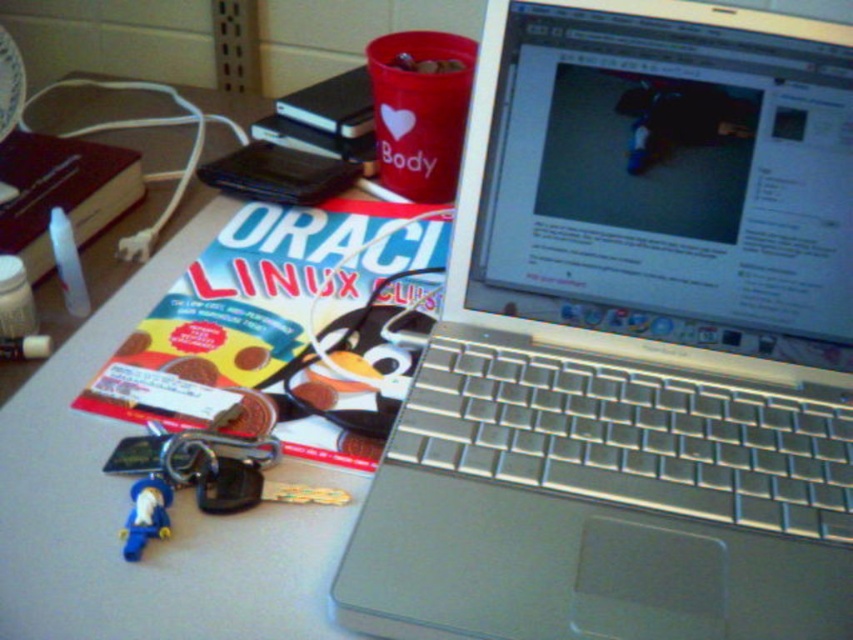
You are organizing your desk and need to place a new item between the silver metallic laptop at center and the blue plastic toy at lower left. The item you want to place is 15 centimeters long. Will there be enough space between them to fit this item?

The distance between the silver metallic laptop at center and the blue plastic toy at lower left is 26.64 centimeters. Since the item you want to place is 15 centimeters long, there is sufficient space as 26.64 cm is greater than 15 cm.

You are organizing items on a desk and see the silver metallic laptop at center and the blue plastic toy at lower left. Which item is positioned more towards the right side of the desk?

The silver metallic laptop at center is positioned to the right of the blue plastic toy at lower left, so it is more towards the right side of the desk.